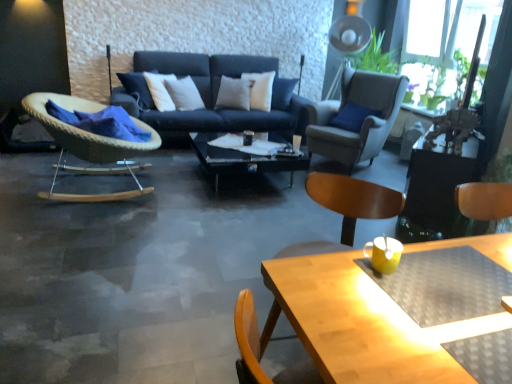
Question: From the image's perspective, is woven wood rocking chair at left, arranged as the first chair when viewed from the left, on top of wooden table at lower right?

Choices:
 (A) no
 (B) yes

Answer: (B)

Question: From a real-world perspective, is woven wood rocking chair at left, arranged as the first chair when viewed from the left, on wooden table at lower right?

Choices:
 (A) no
 (B) yes

Answer: (A)

Question: Is wooden table at lower right at the back of woven wood rocking chair at left, arranged as the first chair when viewed from the left?

Choices:
 (A) no
 (B) yes

Answer: (A)

Question: Is woven wood rocking chair at left, acting as the 2th chair starting from the right, positioned in front of wooden table at lower right?

Choices:
 (A) yes
 (B) no

Answer: (B)

Question: Is woven wood rocking chair at left, arranged as the first chair when viewed from the left, smaller than wooden table at lower right?

Choices:
 (A) yes
 (B) no

Answer: (B)

Question: From a real-world perspective, is woven wood rocking chair at left, acting as the 2th chair starting from the right, below wooden table at lower right?

Choices:
 (A) no
 (B) yes

Answer: (B)

Question: From the image's perspective, does wooden table at lower right appear higher than wooden beach chair at lower right?

Choices:
 (A) yes
 (B) no

Answer: (B)

Question: From the image's perspective, is wooden table at lower right beneath wooden beach chair at lower right?

Choices:
 (A) no
 (B) yes

Answer: (B)

Question: Is wooden table at lower right not close to wooden beach chair at lower right?

Choices:
 (A) yes
 (B) no

Answer: (B)

Question: Considering the relative positions of wooden table at lower right and wooden beach chair at lower right in the image provided, is wooden table at lower right behind wooden beach chair at lower right?

Choices:
 (A) no
 (B) yes

Answer: (A)

Question: Is wooden table at lower right facing away from wooden beach chair at lower right?

Choices:
 (A) no
 (B) yes

Answer: (A)

Question: Is wooden table at lower right taller than wooden beach chair at lower right?

Choices:
 (A) no
 (B) yes

Answer: (A)

Question: Does wooden beach chair at lower right come behind transparent glass coffee table at center?

Choices:
 (A) yes
 (B) no

Answer: (B)